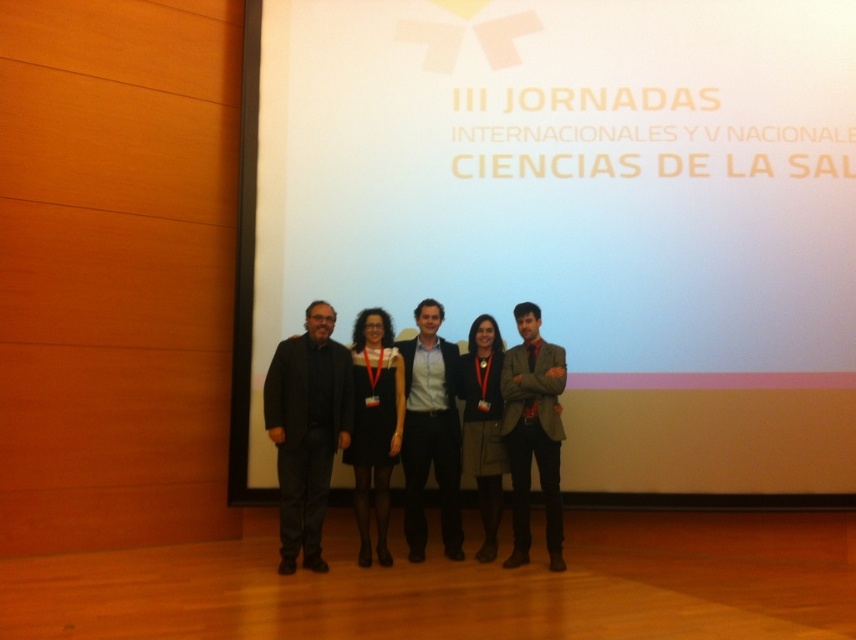
You are organizing a photo shoot and need to position two key models wearing the black matte suit at left and dark gray wool coat at center. According to the scene description, which model should stand on the left side of the photo shoot setup?

The model wearing the black matte suit at left should stand on the left side of the photo shoot setup because the black matte suit at left is positioned to the left of the dark gray wool coat at center in the original scene.

Based on the scene description, which object is positioned to the left of the other? The light blue shirt at center or the matte gray blazer at center?

The light blue shirt at center is positioned to the left of the matte gray blazer at center.

In the scene shown: How far apart are the two people closest to the point at coordinates [456,458]?

The two people closest to the point at coordinates [456,458] are 5.54 meters apart.